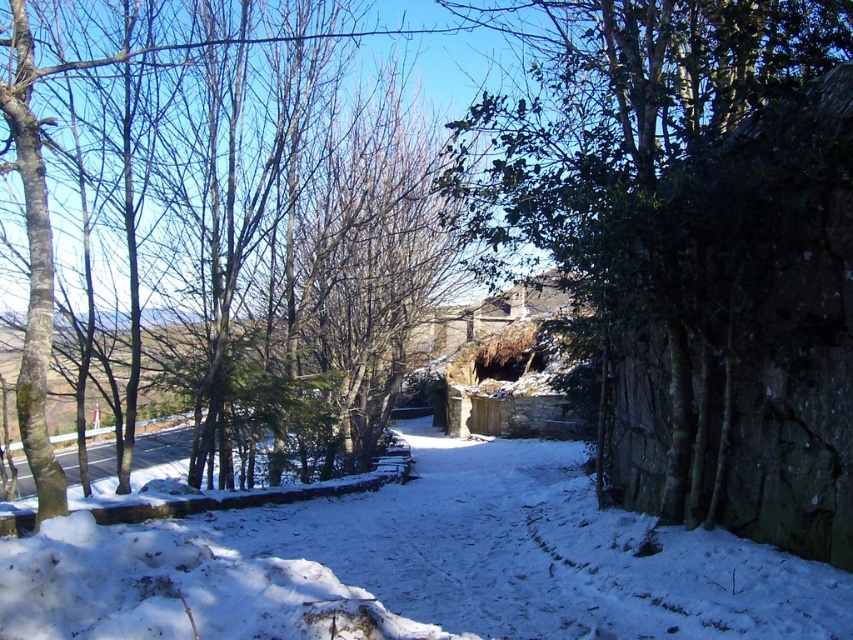
Is point (781, 64) in front of point (35, 484)?

Yes, it is in front of point (35, 484).

Who is higher up, green leafy tree at right or brown bark tree at left?

green leafy tree at right is above.

Where is `green leafy tree at right`? The height and width of the screenshot is (640, 853). green leafy tree at right is located at coordinates (669, 177).

This screenshot has width=853, height=640. Find the location of `green leafy tree at right`. green leafy tree at right is located at coordinates point(669,177).

Who is shorter, white powdery snow at center or brown bark tree at left?

With less height is white powdery snow at center.

Who is more forward, (479, 592) or (45, 483)?

Positioned in front is point (45, 483).

You are a GUI agent. You are given a task and a screenshot of the screen. Output one action in this format:
    pyautogui.click(x=<x>, y=<y>)
    Task: Click on the white powdery snow at center
    Image resolution: width=853 pixels, height=640 pixels.
    Given the screenshot: What is the action you would take?
    421,564

In order to click on white powdery snow at center in this screenshot , I will do `click(421, 564)`.

Is green leafy tree at right below white powdery snow at center?

Actually, green leafy tree at right is above white powdery snow at center.

Measure the distance between green leafy tree at right and white powdery snow at center.

7.53 feet

Is point (492, 12) positioned after point (639, 593)?

Yes.

Identify the location of green leafy tree at right. Image resolution: width=853 pixels, height=640 pixels. (669, 177).